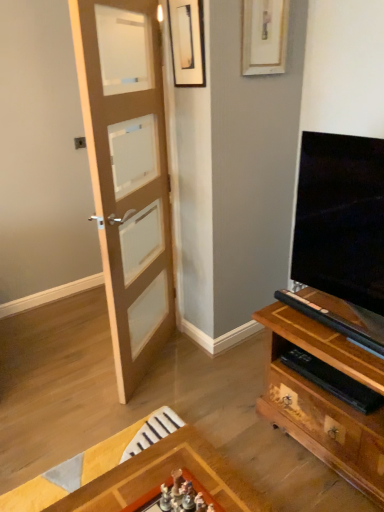
I want to click on vacant area situated below light brown wooden door at left (from a real-world perspective), so click(x=153, y=367).